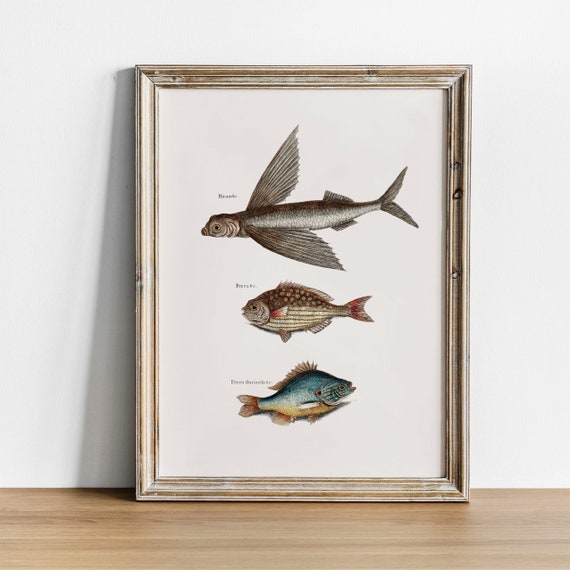
The image size is (570, 570). In order to click on shadow cast by picture in this screenshot , I will do `click(104, 415)`.